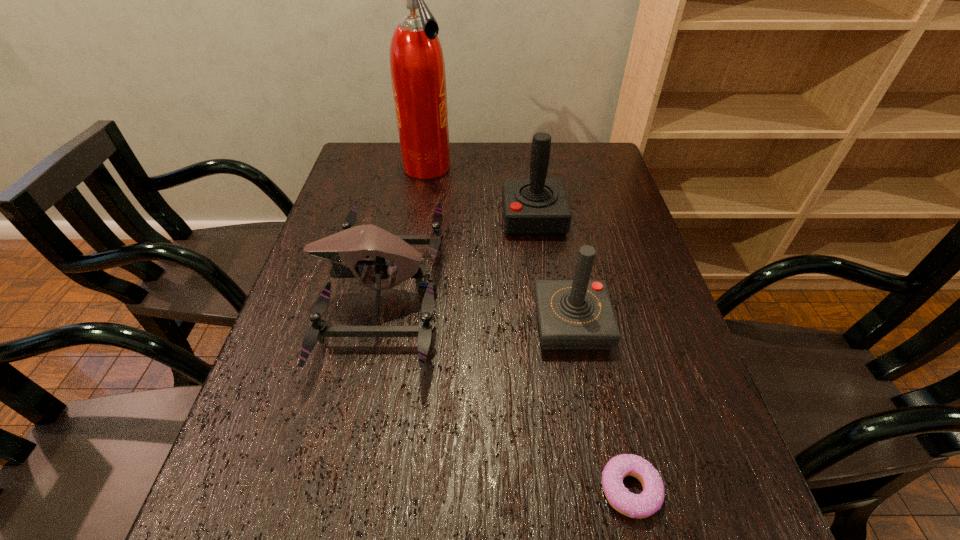
Locate an element on the screen. vacant region that satisfies the following two spatial constraints: 1. on the rectangular base of the shortest object; 2. on the left side of the shorter joystick is located at coordinates (603, 489).

Identify the location of vacant area in the image that satisfies the following two spatial constraints: 1. on the rectangular base of the shortest object; 2. on the right side of the shorter joystick. [x=603, y=489].

The height and width of the screenshot is (540, 960). What are the coordinates of `vacant space that satisfies the following two spatial constraints: 1. on the base of the shortest object; 2. on the left side of the farther joystick` in the screenshot? It's located at (572, 489).

The height and width of the screenshot is (540, 960). Find the location of `vacant space that satisfies the following two spatial constraints: 1. on the base of the farther joystick; 2. on the right side of the shortest object`. vacant space that satisfies the following two spatial constraints: 1. on the base of the farther joystick; 2. on the right side of the shortest object is located at coordinates (572, 489).